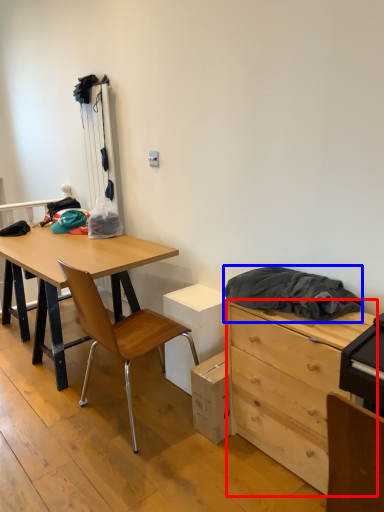
Question: Which of the following is the closest to the observer, chest of drawers (highlighted by a red box) or clothing (highlighted by a blue box)?

Choices:
 (A) chest of drawers
 (B) clothing

Answer: (A)